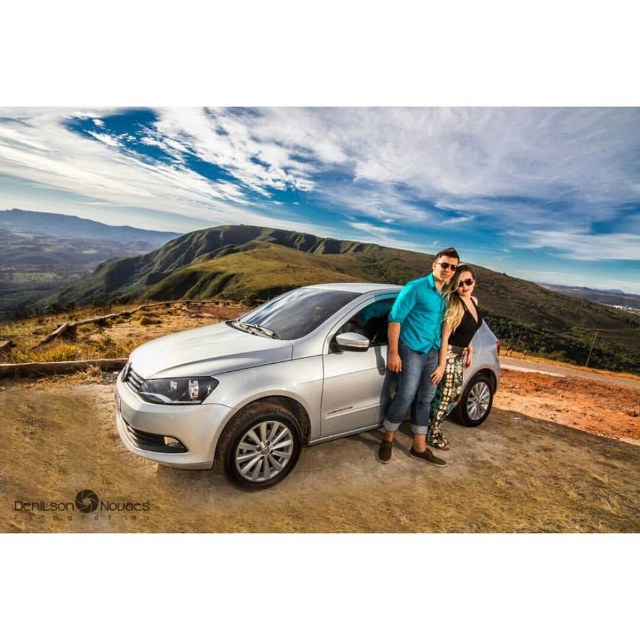
Does teal fabric shirt at center appear under printed fabric pants at center?

No.

Who is positioned more to the left, teal fabric shirt at center or printed fabric pants at center?

Positioned to the left is teal fabric shirt at center.

This screenshot has height=640, width=640. Describe the element at coordinates (417, 353) in the screenshot. I see `teal fabric shirt at center` at that location.

Where is `teal fabric shirt at center`? The width and height of the screenshot is (640, 640). teal fabric shirt at center is located at coordinates (417, 353).

Between point (376, 406) and point (433, 358), which one is positioned in front?

Point (376, 406) is in front.

Which is more to the right, satin silver car at center or teal fabric shirt at center?

Positioned to the right is teal fabric shirt at center.

Who is more forward, (x=173, y=433) or (x=417, y=333)?

Point (x=173, y=433) is more forward.

You are a GUI agent. You are given a task and a screenshot of the screen. Output one action in this format:
    pyautogui.click(x=<x>, y=<y>)
    Task: Click on the satin silver car at center
    The width and height of the screenshot is (640, 640).
    Given the screenshot: What is the action you would take?
    pyautogui.click(x=260, y=384)

Can you confirm if satin silver car at center is positioned to the right of printed fabric pants at center?

Incorrect, satin silver car at center is not on the right side of printed fabric pants at center.

Between satin silver car at center and printed fabric pants at center, which one appears on the left side from the viewer's perspective?

satin silver car at center is more to the left.

Is point (252, 465) positioned in front of point (444, 324)?

Yes.

Where is `satin silver car at center`? This screenshot has height=640, width=640. satin silver car at center is located at coordinates (260, 384).